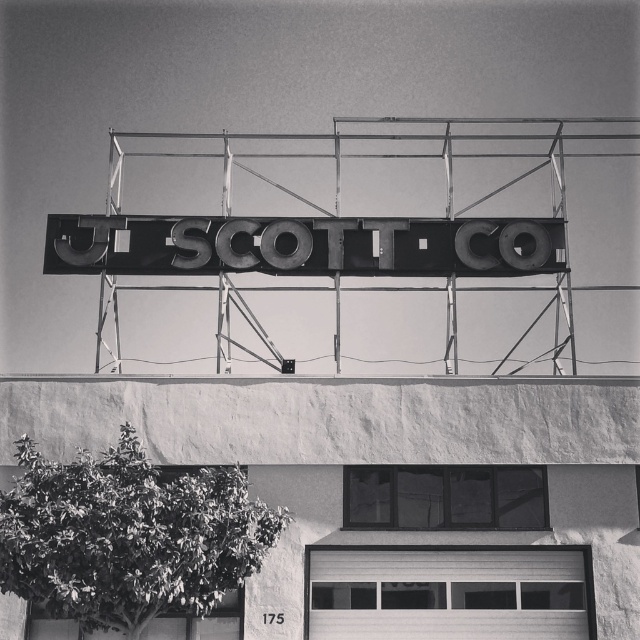
You are a delivery driver trying to find the JL SCOTT CO. building. You see the metallic letters at center and the smooth white garage door at lower center. Which object should you look for first to locate the building?

The metallic letters at center are located above the smooth white garage door at lower center. Since the letters are part of the building sign, they are the primary identifier for the JL SCOTT CO. building. Look for the metallic letters at center first to locate the building.

Looking at this image, based on the scene description, where is the metallic letters at center located in terms of 2D coordinates?

The metallic letters at center are located at the 2D coordinates of point [301,244].